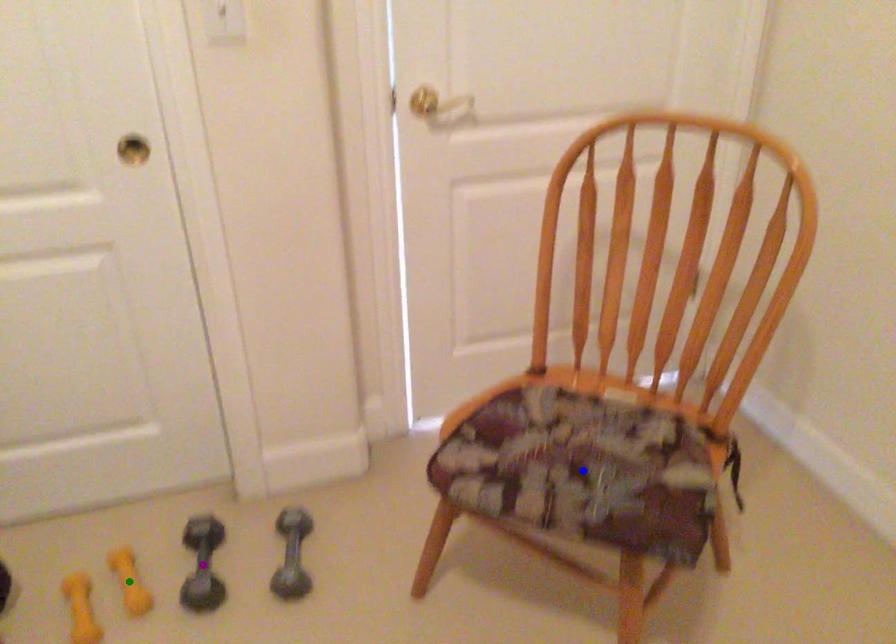
Order these from nearest to farthest:
blue point, green point, purple point

1. blue point
2. green point
3. purple point